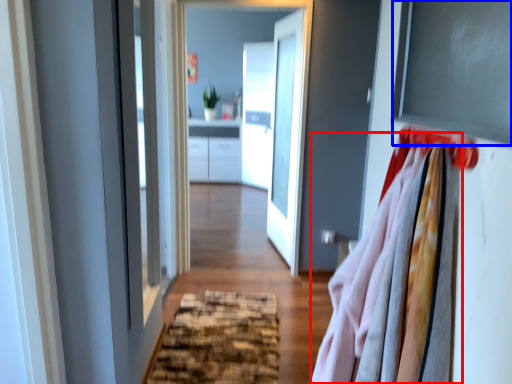
Question: Which of the following is the closest to the observer, clothing (highlighted by a red box) or window screen (highlighted by a blue box)?

Choices:
 (A) clothing
 (B) window screen

Answer: (A)